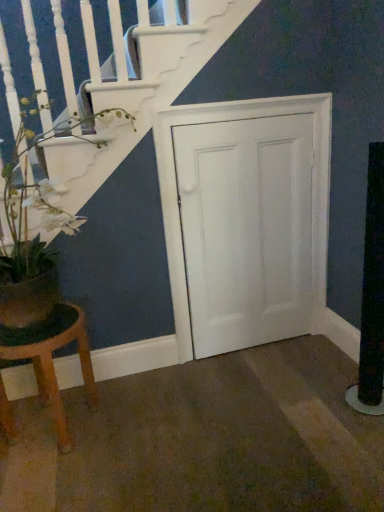
At what (x,y) coordinates should I click in order to perform the action: click on vacant area that lies to the right of white wood door at center. Please return your answer as a coordinate pair (x, y). Image resolution: width=384 pixels, height=512 pixels. Looking at the image, I should click on (305, 356).